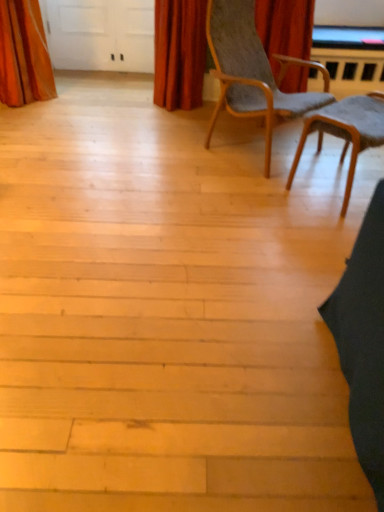
Question: Is wooden textured chair at center right, the second chair from the left, wider than velvet red curtain at upper center, the 2th curtain from the left?

Choices:
 (A) no
 (B) yes

Answer: (B)

Question: Considering the relative sizes of wooden textured chair at center right, which is the 1th chair from right to left, and velvet red curtain at upper center, the 2th curtain from the left, in the image provided, is wooden textured chair at center right, which is the 1th chair from right to left, bigger than velvet red curtain at upper center, the 2th curtain from the left,?

Choices:
 (A) yes
 (B) no

Answer: (A)

Question: From a real-world perspective, is wooden textured chair at center right, which is the 1th chair from right to left, physically above velvet red curtain at upper center, the 2th curtain from the left?

Choices:
 (A) yes
 (B) no

Answer: (B)

Question: From the image's perspective, is wooden textured chair at center right, which is the 1th chair from right to left, over velvet red curtain at upper center, the 2th curtain from the left?

Choices:
 (A) yes
 (B) no

Answer: (B)

Question: Is wooden textured chair at center right, the second chair from the left, at the right side of velvet red curtain at upper center, the 2th curtain from the left?

Choices:
 (A) yes
 (B) no

Answer: (A)

Question: Is wooden textured chair at center right, the second chair from the left, to the left of velvet red curtain at upper center, the 1th curtain when ordered from right to left, from the viewer's perspective?

Choices:
 (A) no
 (B) yes

Answer: (A)

Question: Is wooden textured chair at center right, which is the 1th chair from right to left, positioned in front of light brown wood chair at center, marked as the first chair in a left-to-right arrangement?

Choices:
 (A) no
 (B) yes

Answer: (A)

Question: Can light brown wood chair at center, marked as the first chair in a left-to-right arrangement, be found inside wooden textured chair at center right, the second chair from the left?

Choices:
 (A) no
 (B) yes

Answer: (A)

Question: From a real-world perspective, does wooden textured chair at center right, the second chair from the left, stand above light brown wood chair at center, marked as the first chair in a left-to-right arrangement?

Choices:
 (A) no
 (B) yes

Answer: (A)

Question: Is wooden textured chair at center right, which is the 1th chair from right to left, facing away from light brown wood chair at center, the 2th chair positioned from the right?

Choices:
 (A) no
 (B) yes

Answer: (B)

Question: Is wooden textured chair at center right, the second chair from the left, not inside light brown wood chair at center, the 2th chair positioned from the right?

Choices:
 (A) yes
 (B) no

Answer: (A)

Question: From the image's perspective, is wooden textured chair at center right, the second chair from the left, located beneath light brown wood chair at center, the 2th chair positioned from the right?

Choices:
 (A) yes
 (B) no

Answer: (A)

Question: Considering the relative sizes of orange velvet curtain at upper left, which appears as the 1th curtain when viewed from the left, and velvet red curtain at upper center, the 1th curtain when ordered from right to left, in the image provided, is orange velvet curtain at upper left, which appears as the 1th curtain when viewed from the left, shorter than velvet red curtain at upper center, the 1th curtain when ordered from right to left,?

Choices:
 (A) yes
 (B) no

Answer: (A)